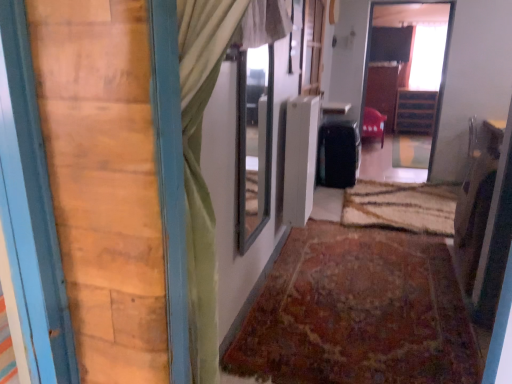
Question: In terms of height, does matte red chair at center, acting as the 2th furniture starting from the right, look taller or shorter compared to wooden cabinet at center, the 1th furniture in the back-to-front sequence?

Choices:
 (A) tall
 (B) short

Answer: (B)

Question: Is point (382, 134) positioned closer to the camera than point (414, 97)?

Choices:
 (A) closer
 (B) farther

Answer: (B)

Question: Based on their relative distances, which object is farther from the clear glass window at center, placed as the first window when sorted from bottom to top?

Choices:
 (A) wooden cabinet at center, which is the second furniture from left to right
 (B) wooden barn door at left
 (C) matte red chair at center, which appears as the 1th furniture when viewed from the left
 (D) transparent glass window at upper right, the second window from the left
 (E) wooden dresser at upper right

Answer: (C)

Question: Which of these objects is positioned closest to the wooden cabinet at center, marked as the 1th furniture in a right-to-left arrangement?

Choices:
 (A) wooden dresser at upper right
 (B) black matte suitcase at center
 (C) transparent glass window at upper right, which ranks as the 1th window in right-to-left order
 (D) clear glass window at center, placed as the first window when sorted from bottom to top
 (E) rug at center, marked as the 1th doormat in a front-to-back arrangement

Answer: (A)